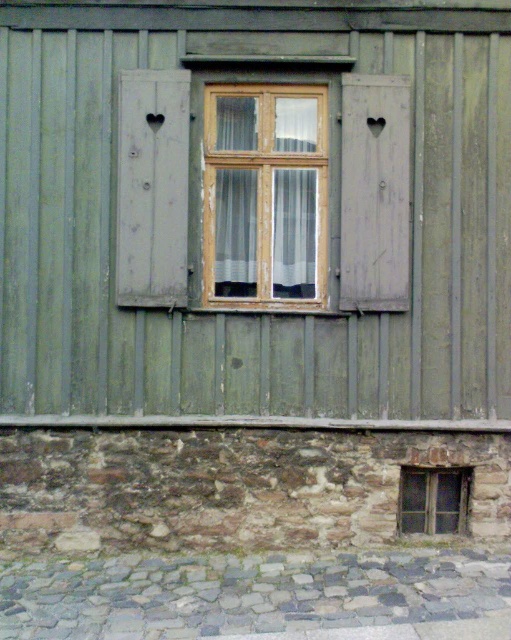
You are standing in front of the building and notice two points marked on its exterior wall. The first point is at coordinates point (313, 122) and the second is at point (424, 509). Which point is closer to you?

Point (424, 509) is closer to you because point (313, 122) is behind it.